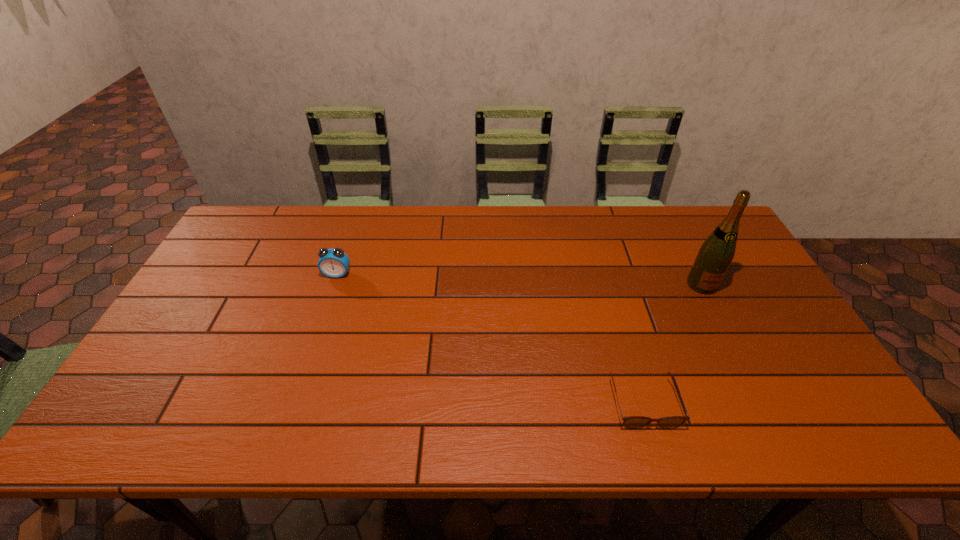
Where is `vacant space at the far edge of the desktop`? vacant space at the far edge of the desktop is located at coordinates (627, 248).

The height and width of the screenshot is (540, 960). In order to click on vacant space at the near edge of the desktop in this screenshot , I will do point(756,440).

In the image, there is a desktop. Where is `vacant space at the left edge`? The width and height of the screenshot is (960, 540). vacant space at the left edge is located at coordinates (190, 366).

At what (x,y) coordinates should I click in order to perform the action: click on vacant space at the right edge of the desktop. Please return your answer as a coordinate pair (x, y). Looking at the image, I should click on (782, 323).

The width and height of the screenshot is (960, 540). I want to click on vacant region at the far left corner, so click(264, 235).

Where is `free space between the tallest object and the nearest object`? The width and height of the screenshot is (960, 540). free space between the tallest object and the nearest object is located at coordinates (672, 344).

Identify the location of vacant space in between the tallest object and the shortest object. The height and width of the screenshot is (540, 960). (672, 344).

You are a GUI agent. You are given a task and a screenshot of the screen. Output one action in this format:
    pyautogui.click(x=<x>, y=<y>)
    Task: Click on the vacant region between the shortest object and the tallest object
    
    Given the screenshot: What is the action you would take?
    pyautogui.click(x=672, y=344)

Identify the location of free space between the shortest object and the wine bottle. (672, 344).

Where is `vacant space in between the alarm clock and the shortest object`? vacant space in between the alarm clock and the shortest object is located at coordinates pyautogui.click(x=491, y=339).